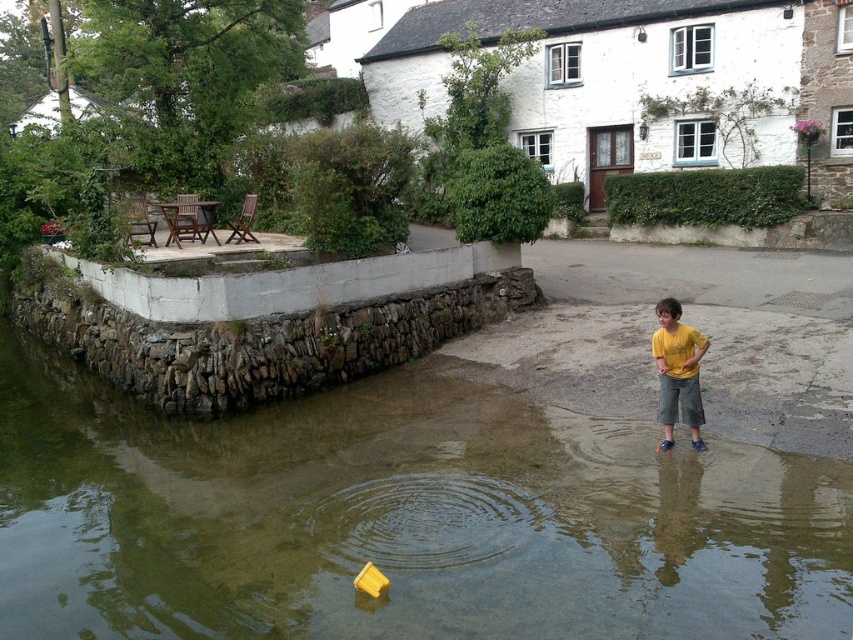
You are standing at the white building with a dark gray roof and want to walk to the wooden patio area with a table and chairs. There are two points marked on the path you can take. The first point is at coordinate point (15, 609) and the second point is at coordinate point (686, 307). Which point should you choose to reach the wooden patio area with a table and chairs first?

Point (15, 609) is in front of point (686, 307), so you should choose point (15, 609) to reach the wooden patio area with a table and chairs first.

Based on the photo, you are a photographer trying to capture the child in the scene. You want to frame the shot so that the yellow cotton shirt at lower right is on the right side of the greenish water at lower left. Is this possible based on the current arrangement?

Yes, because the greenish water at lower left is positioned on the left side of the yellow cotton shirt at lower right, which aligns with your desired framing.